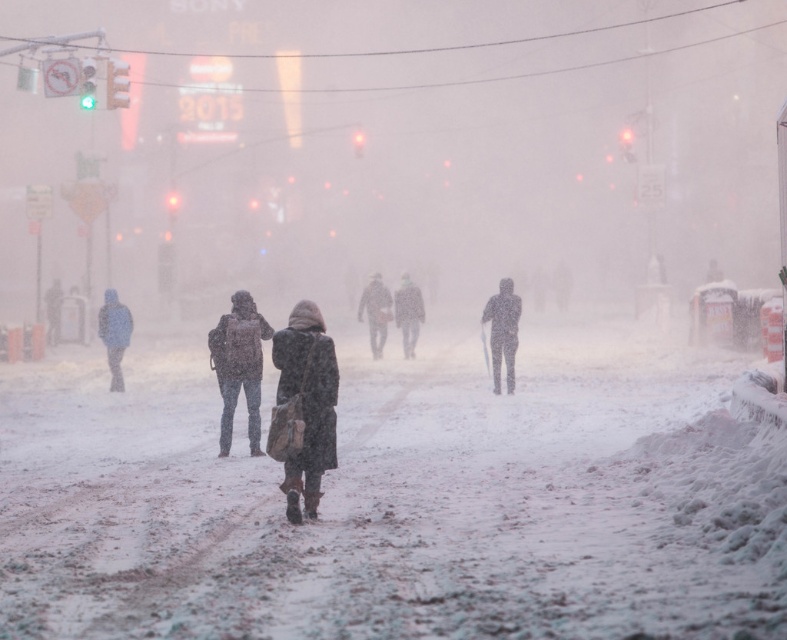
Question: Which point is closer to the camera taking this photo?

Choices:
 (A) (375, 285)
 (B) (119, 342)

Answer: (B)

Question: Based on their relative distances, which object is farther from the dark gray coat at left?

Choices:
 (A) white snow-covered figure at center
 (B) dark gray coat at center
 (C) dark brown leather jacket at center
 (D) dark brown coat at center

Answer: (C)

Question: Among these objects, which one is nearest to the camera?

Choices:
 (A) dark gray coat at center
 (B) dark gray coat at left

Answer: (B)

Question: Observing the image, what is the correct spatial positioning of dark brown coat at center in reference to dark gray coat at center?

Choices:
 (A) left
 (B) right

Answer: (A)

Question: Is dark brown leather jacket at center to the right of white snow-covered figure at center from the viewer's perspective?

Choices:
 (A) no
 (B) yes

Answer: (A)

Question: Does dark brown leather coat at center appear on the right side of white snow-covered figure at center?

Choices:
 (A) yes
 (B) no

Answer: (B)